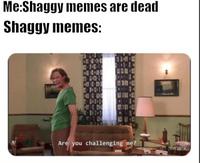
This screenshot has height=163, width=200. I want to click on brown couch, so click(105, 134).